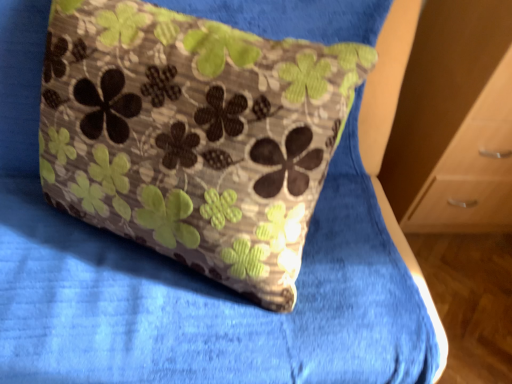
In order to face light brown wooden dresser at right, should I rotate leftwards or rightwards?

Turn right by 32.154 degrees to look at light brown wooden dresser at right.

Describe the element at coordinates (455, 122) in the screenshot. I see `light brown wooden dresser at right` at that location.

You are a GUI agent. You are given a task and a screenshot of the screen. Output one action in this format:
    pyautogui.click(x=<x>, y=<y>)
    Task: Click on the light brown wooden dresser at right
    The image size is (512, 384).
    Given the screenshot: What is the action you would take?
    pyautogui.click(x=455, y=122)

This screenshot has width=512, height=384. Find the location of `light brown wooden dresser at right`. light brown wooden dresser at right is located at coordinates (455, 122).